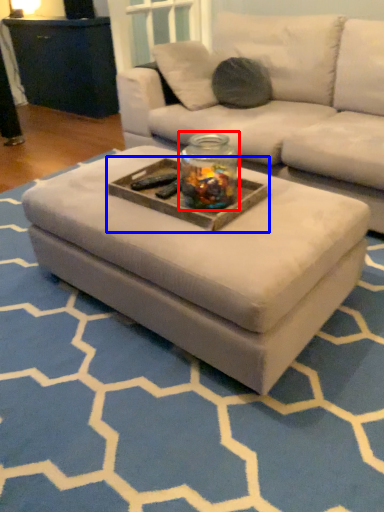
Question: Which object appears farthest to the camera in this image, glass jar (highlighted by a red box) or tray (highlighted by a blue box)?

Choices:
 (A) glass jar
 (B) tray

Answer: (B)